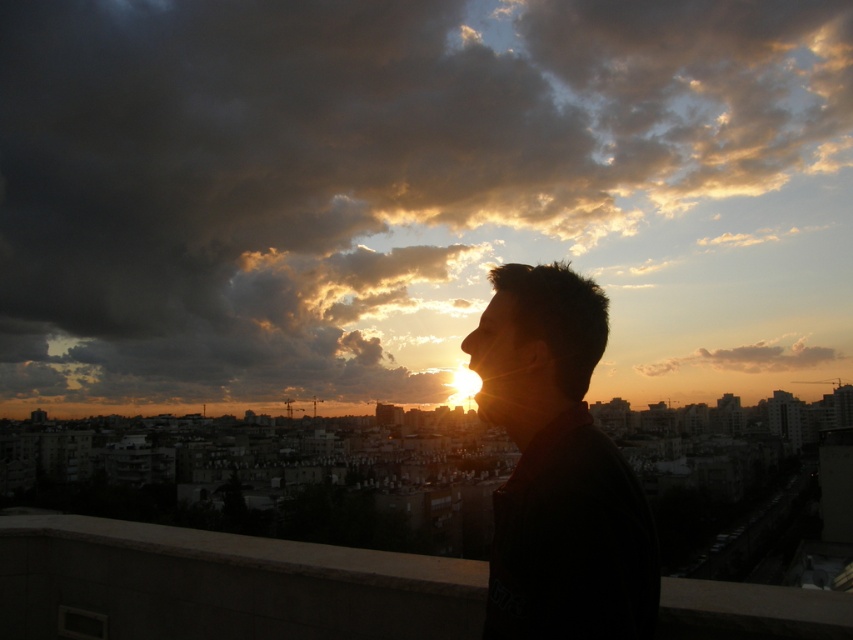
Is point (529, 380) less distant than point (498, 323)?

Yes, point (529, 380) is in front of point (498, 323).

Can you confirm if silhouette hair at right is positioned above silhouette hair at center?

No.

What do you see at coordinates (558, 468) in the screenshot? I see `silhouette hair at right` at bounding box center [558, 468].

I want to click on silhouette hair at right, so click(x=558, y=468).

Can you confirm if dark gray cloud at upper center is taller than silhouette hair at center?

Yes.

Can you confirm if dark gray cloud at upper center is wider than silhouette hair at center?

Yes, dark gray cloud at upper center is wider than silhouette hair at center.

Where is `dark gray cloud at upper center`? The width and height of the screenshot is (853, 640). dark gray cloud at upper center is located at coordinates (410, 193).

Who is positioned more to the right, silhouette hair at right or white fluffy cloud at upper center?

white fluffy cloud at upper center is more to the right.

Who is shorter, silhouette hair at right or white fluffy cloud at upper center?

With less height is white fluffy cloud at upper center.

Consider the image. Measure the distance between silhouette hair at right and camera.

They are 41.94 meters apart.

Find the location of a particular element. Image resolution: width=853 pixels, height=640 pixels. silhouette hair at right is located at coordinates (558, 468).